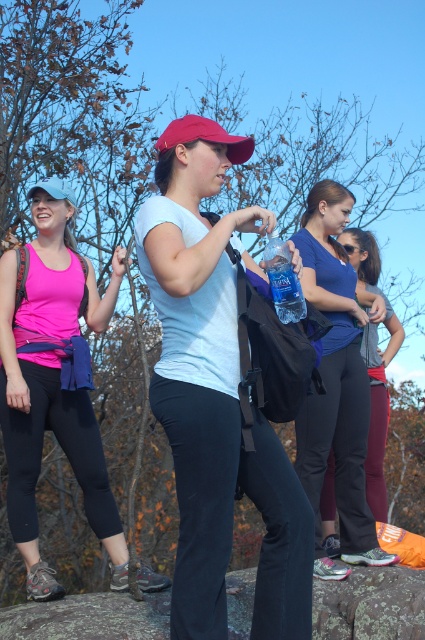
You are standing at the point labeled as point (x=176, y=353) in the image. A hiker wants to throw a small rock to you. If the hiker can throw the rock up to 3 meters, will they be able to reach you?

The distance between point (x=176, y=353) and the viewer is exactly 3.02 meters. Since the hiker can throw up to 3 meters, they will not be able to reach you as the distance is slightly beyond their throwing range.

You are a hiker trying to navigate through the rocky area. You see two points marked as point (76, 385) and point (56, 195). Which point is closer to your current position if you are standing at the starting point of the trail?

Point (76, 385) is closer to your current position because it is in front of point (56, 195).

Based on the photo, you are a hiker who needs to place a 2.5 meter long tent between the smooth rock at center and the blue fabric baseball cap at upper left. Is there enough space?

The distance between the smooth rock at center and the blue fabric baseball cap at upper left is 2.76 meters, which is sufficient to place a 2.5 meter long tent between them.